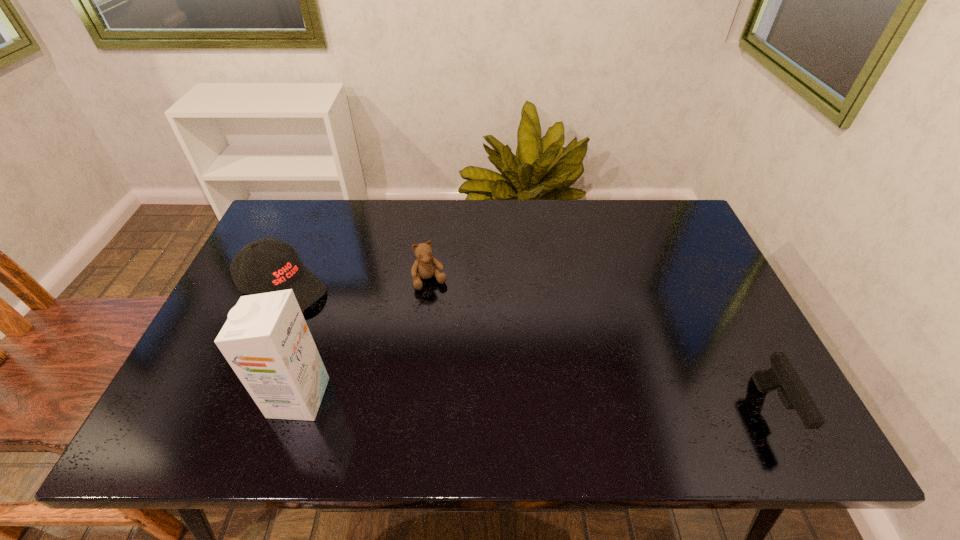
I want to click on free region at the far left corner of the desktop, so click(x=288, y=222).

Image resolution: width=960 pixels, height=540 pixels. In order to click on blank space at the far right corner of the desktop in this screenshot , I will do `click(679, 212)`.

The height and width of the screenshot is (540, 960). I want to click on free space that is in between the baseball cap and the teddy bear, so click(357, 284).

Image resolution: width=960 pixels, height=540 pixels. I want to click on empty location between the pistol and the baseball cap, so click(x=528, y=349).

Locate an element on the screen. The width and height of the screenshot is (960, 540). free space between the carton and the rightmost object is located at coordinates (536, 404).

The width and height of the screenshot is (960, 540). I want to click on free spot between the second object from right to left and the pistol, so point(601,345).

Find the location of a particular element. vacant region between the baseball cap and the pistol is located at coordinates (528, 349).

The image size is (960, 540). Find the location of `vacant area that lies between the second object from right to left and the baseball cap`. vacant area that lies between the second object from right to left and the baseball cap is located at coordinates (357, 284).

At what (x,y) coordinates should I click in order to perform the action: click on vacant area between the baseball cap and the rightmost object. Please return your answer as a coordinate pair (x, y). The image size is (960, 540). Looking at the image, I should click on (528, 349).

Find the location of a particular element. This screenshot has width=960, height=540. blank region between the baseball cap and the second object from right to left is located at coordinates (357, 284).